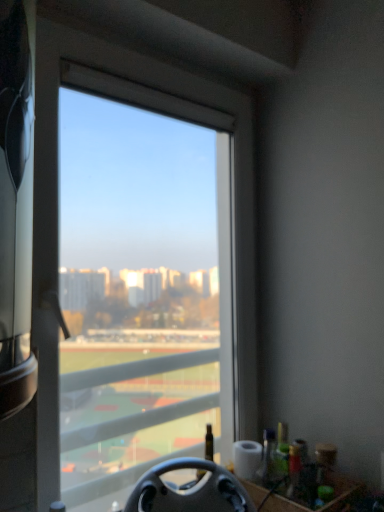
Question: Do you think black matte steering wheel at lower center is within transparent glass window at center, or outside of it?

Choices:
 (A) inside
 (B) outside

Answer: (B)

Question: Considering the positions of black matte steering wheel at lower center and transparent glass window at center in the image, is black matte steering wheel at lower center taller or shorter than transparent glass window at center?

Choices:
 (A) tall
 (B) short

Answer: (B)

Question: Considering the positions of black matte steering wheel at lower center and transparent glass window at center in the image, is black matte steering wheel at lower center wider or thinner than transparent glass window at center?

Choices:
 (A) thin
 (B) wide

Answer: (B)

Question: Considering the positions of transparent glass window at center and black matte steering wheel at lower center in the image, is transparent glass window at center taller or shorter than black matte steering wheel at lower center?

Choices:
 (A) short
 (B) tall

Answer: (B)

Question: Is transparent glass window at center situated inside black matte steering wheel at lower center or outside?

Choices:
 (A) inside
 (B) outside

Answer: (B)

Question: Considering the positions of transparent glass window at center and black matte steering wheel at lower center in the image, is transparent glass window at center wider or thinner than black matte steering wheel at lower center?

Choices:
 (A) wide
 (B) thin

Answer: (B)

Question: Considering the relative positions of transparent glass window at center and black matte steering wheel at lower center in the image provided, is transparent glass window at center to the left or to the right of black matte steering wheel at lower center?

Choices:
 (A) left
 (B) right

Answer: (A)